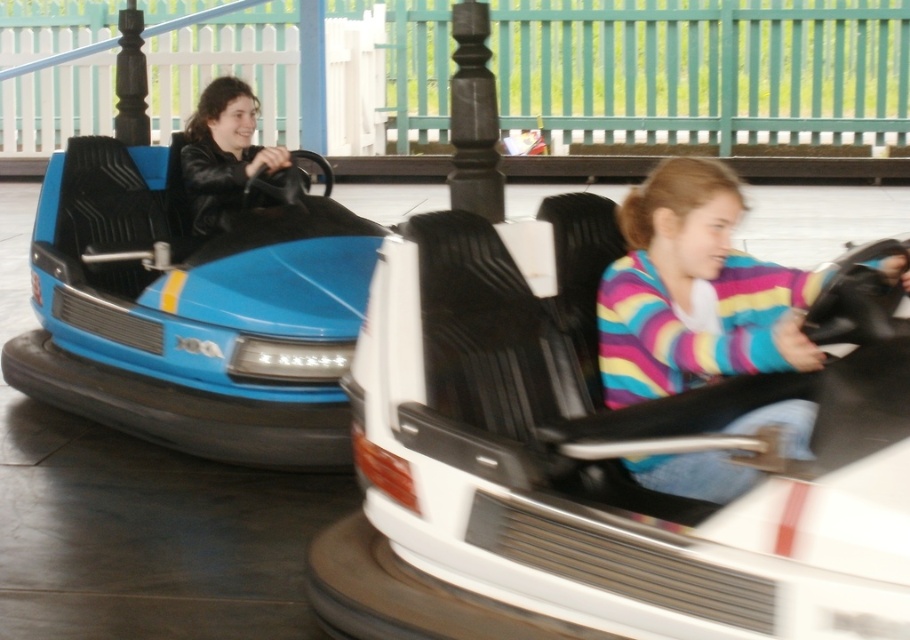
Looking at this image, you are at an amusement park and see two people in the bumper car area. One is wearing a striped sweater at center and the other is wearing a matte black jacket at left. Which person is wearing a larger garment?

The striped sweater at center is bigger than the matte black jacket at left, so the person wearing the striped sweater at center has the larger garment.